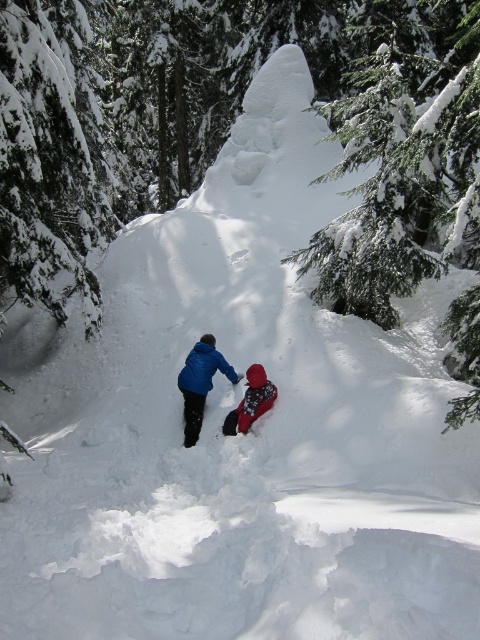
Who is more distant from viewer, (191,368) or (247,410)?

The point (191,368) is behind.

Is blue fabric jacket at center below red fleece jacket at center?

Incorrect, blue fabric jacket at center is not positioned below red fleece jacket at center.

Is point (183, 412) farther from camera compared to point (260, 394)?

That is True.

I want to click on blue fabric jacket at center, so click(201, 381).